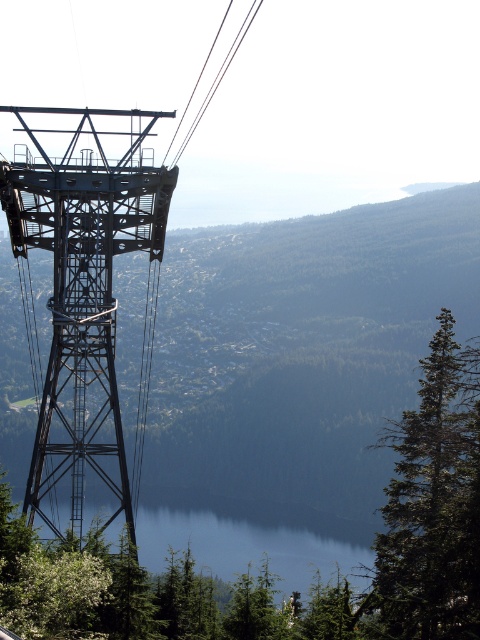
Does metallic structure at left appear on the left side of blue glassy lake at center?

In fact, metallic structure at left is to the right of blue glassy lake at center.

Can you confirm if metallic structure at left is thinner than blue glassy lake at center?

No.

I want to click on metallic structure at left, so click(301, 348).

Can you confirm if blue glassy lake at center is thinner than metallic wire at upper center?

In fact, blue glassy lake at center might be wider than metallic wire at upper center.

Does point (213, 550) lie in front of point (239, 38)?

That is True.

Is point (312, 522) more distant than point (229, 64)?

No, it is not.

Locate an element on the screen. The image size is (480, 640). blue glassy lake at center is located at coordinates (252, 538).

The image size is (480, 640). Describe the element at coordinates (83, 298) in the screenshot. I see `metallic gray tower at left` at that location.

Between point (55, 340) and point (219, 26), which one is positioned in front?

Point (55, 340) is in front.

Between point (151, 237) and point (228, 52), which one is positioned in front?

Point (151, 237)

Locate an element on the screen. The image size is (480, 640). metallic gray tower at left is located at coordinates (83, 298).